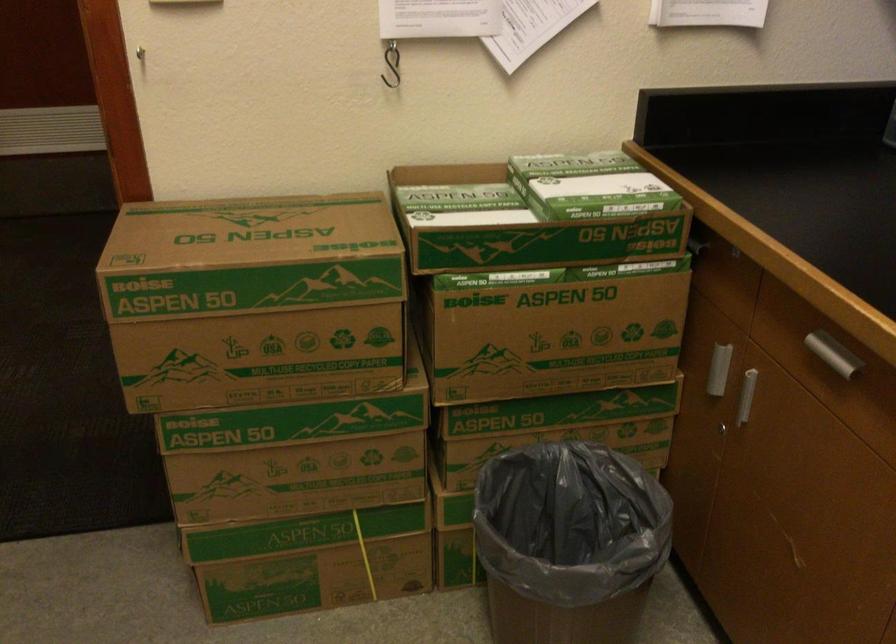
The height and width of the screenshot is (644, 896). What are the coordinates of `black trash bag` in the screenshot? It's located at (570, 521).